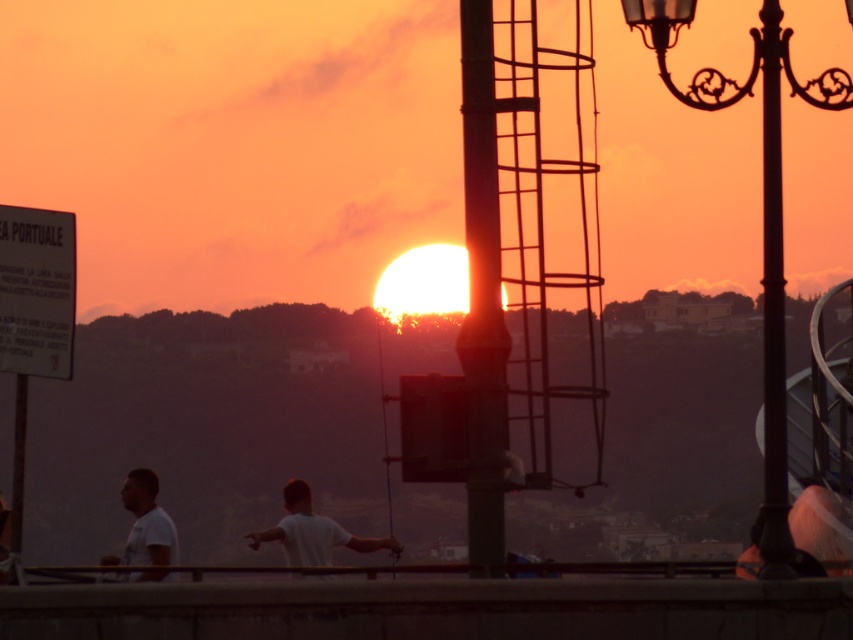
Question: Can you confirm if white cotton t-shirt at center is wider than white matte shirt at lower left?

Choices:
 (A) no
 (B) yes

Answer: (B)

Question: Which point is farther to the camera?

Choices:
 (A) metallic ladder at center
 (B) black wrought iron lamp post at upper right
 (C) white cotton t-shirt at center

Answer: (C)

Question: Based on their relative distances, which object is nearer to the white cotton t-shirt at center?

Choices:
 (A) black metal pole at right
 (B) white matte shirt at lower left
 (C) white matte shirt at center
 (D) black wrought iron lamp post at upper right

Answer: (C)

Question: Is the position of black wrought iron lamp post at upper right more distant than that of white matte shirt at center?

Choices:
 (A) no
 (B) yes

Answer: (A)

Question: Among these points, which one is nearest to the camera?

Choices:
 (A) (820, 96)
 (B) (128, 538)
 (C) (143, 497)

Answer: (A)

Question: Is black wrought iron lamp post at upper right to the right of black metal pole at right from the viewer's perspective?

Choices:
 (A) yes
 (B) no

Answer: (B)